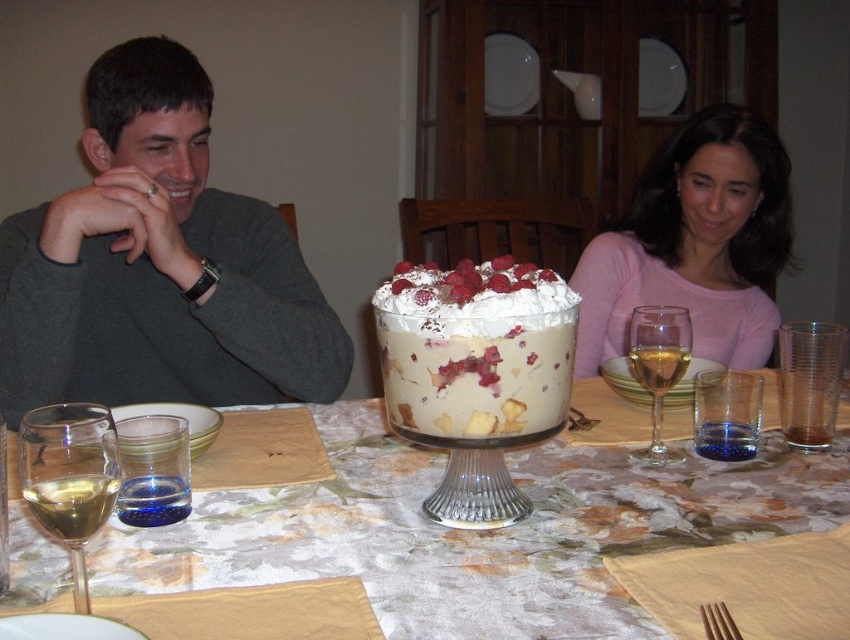
You are a guest at this dinner and want to grab the clear glass wine glass at center right without touching the matte gray sweater at upper left. Is this possible?

The matte gray sweater at upper left is located above the clear glass wine glass at center right, so you can reach the glass without touching the sweater by moving your hand under the sweater.

You are a guest sitting at the dining table and want to reach the clear glass trifle at center. Based on the coordinates provided, can you estimate if you are sitting to the left or right of the trifle?

The clear glass trifle at center is located at coordinates point (x=476, y=531). Since the guest is sitting at the table, if their position is to the left of the trifle, they would be on the left side. However, without knowing the guest exact position, it is impossible to determine definitively.

You are a guest at this dinner and want to pour yourself a drink from the clear glass trifle at center into the clear glass wine glass at lower left. Is this possible based on their sizes?

The clear glass trifle at center is larger in size than the clear glass wine glass at lower left, so pouring the drink from the trifle into the wine glass may not be possible since the wine glass is smaller and might not hold the entire contents.